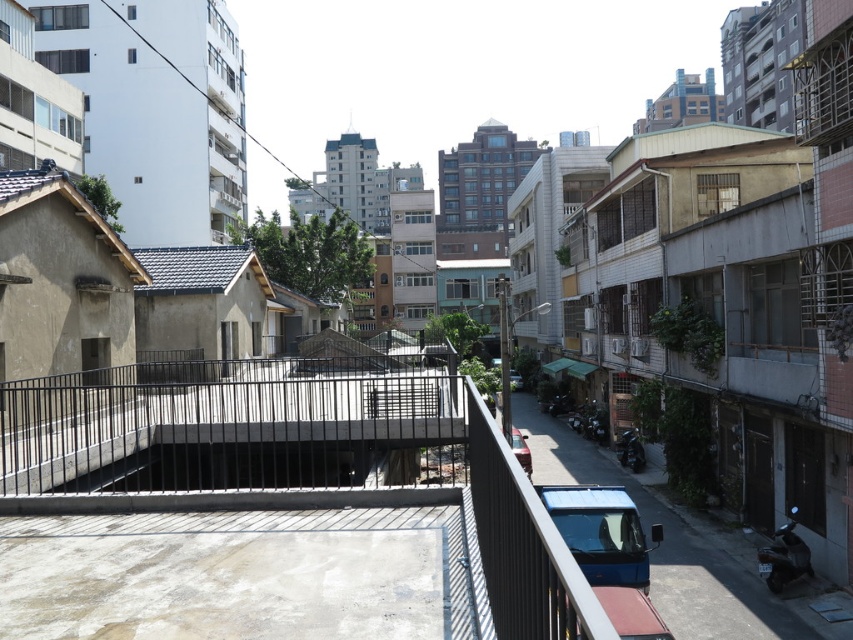
Is metallic silver car at center to the left of silver metallic car at center from the viewer's perspective?

Indeed, metallic silver car at center is positioned on the left side of silver metallic car at center.

The height and width of the screenshot is (640, 853). Describe the element at coordinates (520, 449) in the screenshot. I see `metallic silver car at center` at that location.

Locate an element on the screen. metallic silver car at center is located at coordinates (520, 449).

In the scene shown: Between blue metallic van at lower right and silver metallic car at center, which one has more height?

Standing taller between the two is silver metallic car at center.

Who is more distant from viewer, [584,492] or [518,372]?

Point [518,372]

Between point (628, 525) and point (514, 387), which one is positioned behind?

The point (514, 387) is behind.

Locate an element on the screen. This screenshot has height=640, width=853. blue metallic van at lower right is located at coordinates (601, 532).

Who is more forward, (277, 410) or (589, 540)?

Result: Positioned in front is point (589, 540).

Is black metal railing at center to the right of blue metallic van at lower right from the viewer's perspective?

Incorrect, black metal railing at center is not on the right side of blue metallic van at lower right.

Does point (549, 618) lie behind point (555, 515)?

No, (549, 618) is in front of (555, 515).

Locate an element on the screen. This screenshot has height=640, width=853. black metal railing at center is located at coordinates (293, 458).